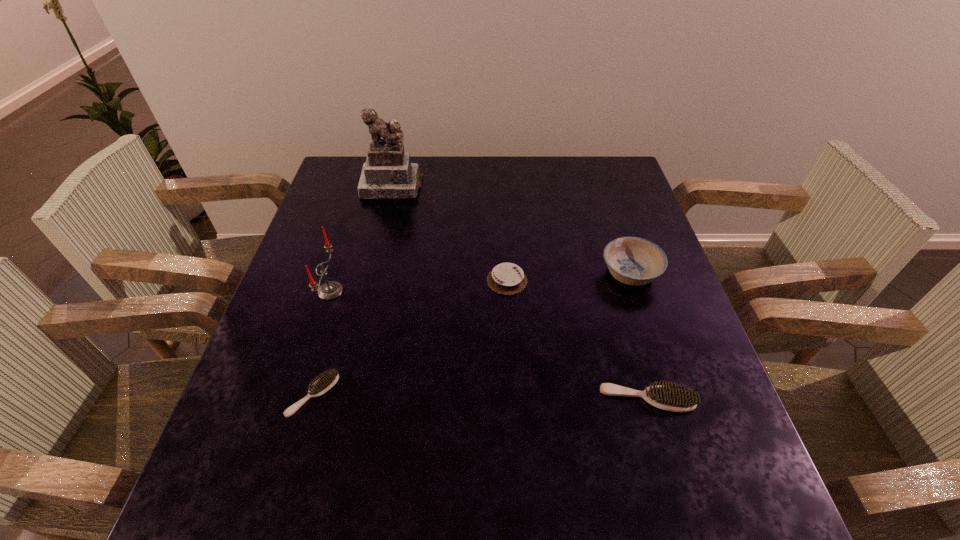
I want to click on free location located 0.370m on the front-facing side of the tallest object, so click(367, 292).

Image resolution: width=960 pixels, height=540 pixels. What are the coordinates of `vacant space located on the front-facing side of the candle` in the screenshot? It's located at (389, 291).

You are a GUI agent. You are given a task and a screenshot of the screen. Output one action in this format:
    pyautogui.click(x=<x>, y=<y>)
    Task: Click on the vacant space located on the back of the fourth shortest object
    This screenshot has height=540, width=960.
    Given the screenshot: What is the action you would take?
    pyautogui.click(x=614, y=229)

Locate an element on the screen. The height and width of the screenshot is (540, 960). free space located 0.160m on the front of the third object from right to left is located at coordinates (512, 352).

Locate an element on the screen. object that is at the far edge is located at coordinates (388, 172).

Where is `scrubbing brush that is at the left edge`? This screenshot has height=540, width=960. scrubbing brush that is at the left edge is located at coordinates (327, 380).

Where is `figurine located in the left edge section of the desktop`? The height and width of the screenshot is (540, 960). figurine located in the left edge section of the desktop is located at coordinates (388, 172).

The height and width of the screenshot is (540, 960). What are the coordinates of `candle that is at the left edge` in the screenshot? It's located at (330, 290).

I want to click on scrubbing brush that is at the right edge, so click(675, 398).

This screenshot has height=540, width=960. Find the location of `bowl situated at the right edge`. bowl situated at the right edge is located at coordinates (635, 261).